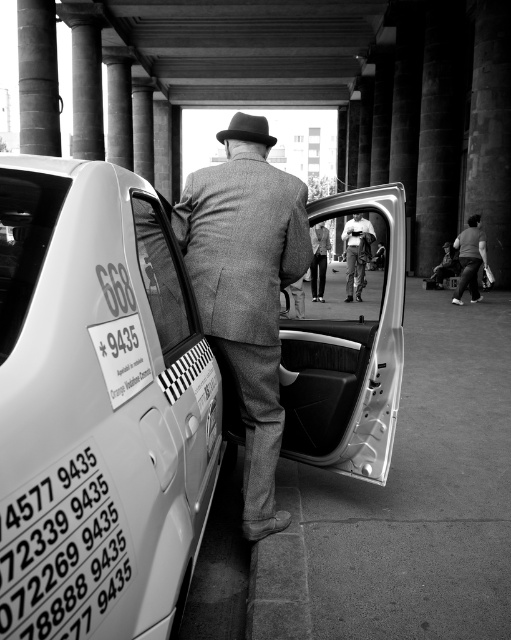
You are a photographer standing in front of the taxi with the open rear door. You notice a textured wool suit at center and a matte gray fedora at center inside the taxi. Which object is nearer to your camera lens?

The textured wool suit at center is closer to the viewer than the matte gray fedora at center, so the textured wool suit at center is nearer to the camera lens.